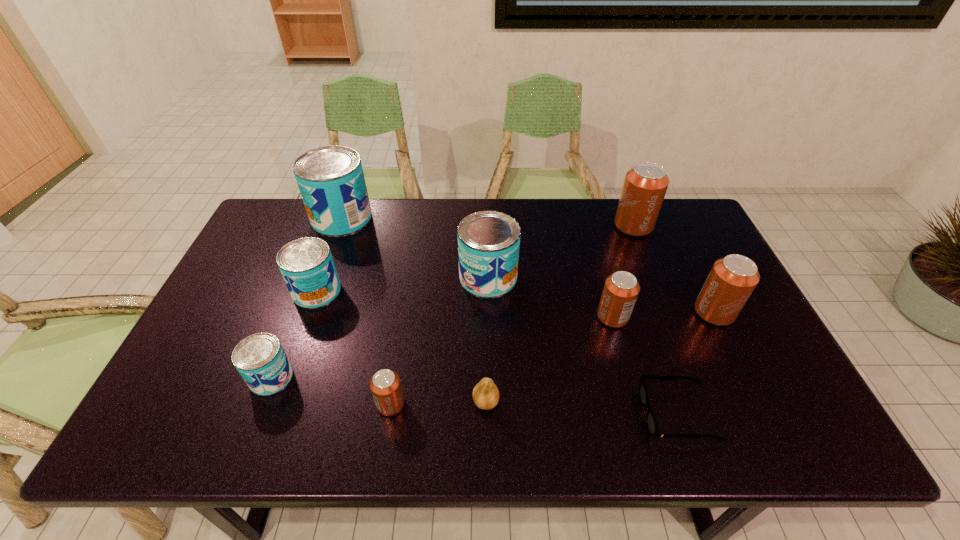
The image size is (960, 540). Find the location of `empty space between the fourth object from left to right and the biggest orange can`. empty space between the fourth object from left to right and the biggest orange can is located at coordinates (512, 315).

Where is `vacant region between the leftmost orange can and the black spectacles`? vacant region between the leftmost orange can and the black spectacles is located at coordinates (534, 409).

Identify the location of free area in between the pear and the shortest object. The image size is (960, 540). (582, 408).

At what (x,y) coordinates should I click in order to perform the action: click on vacant space that is in between the black spectacles and the rightmost can. Please return your answer as a coordinate pair (x, y). Looking at the image, I should click on (695, 363).

Identify the location of vacant area between the nearest orange can and the second orange can from right to left. (512, 315).

Where is `free spot between the fifth can from right to left and the biggest orange can`? Image resolution: width=960 pixels, height=540 pixels. free spot between the fifth can from right to left and the biggest orange can is located at coordinates (512, 315).

Where is `free space between the smallest orange can and the rightmost object`? free space between the smallest orange can and the rightmost object is located at coordinates (552, 358).

The image size is (960, 540). I want to click on empty space that is in between the nearest orange can and the third biggest blue can, so click(353, 348).

This screenshot has width=960, height=540. I want to click on vacant point located between the sixth can from left to right and the nearest blue can, so click(x=442, y=347).

Locate an element on the screen. vacant area between the rightmost orange can and the second orange can from left to right is located at coordinates (663, 315).